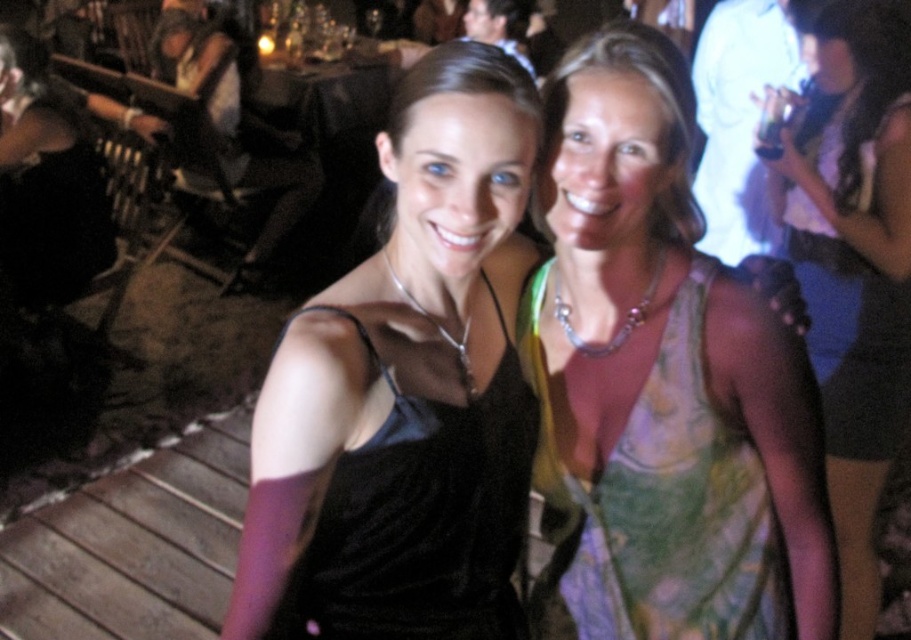
Question: Which object is farther from the camera taking this photo?

Choices:
 (A) printed silk dress at center
 (B) black satin dress at center
 (C) green floral dress at upper right
 (D) green floral dress at center

Answer: (C)

Question: Which object is closer to the camera taking this photo?

Choices:
 (A) green floral dress at upper right
 (B) black satin dress at center
 (C) printed silk dress at center
 (D) green floral dress at center

Answer: (B)

Question: Estimate the real-world distances between objects in this image. Which object is farther from the black satin dress at center?

Choices:
 (A) printed silk dress at center
 (B) green floral dress at upper right
 (C) green floral dress at center

Answer: (C)

Question: Can you confirm if printed silk dress at center is positioned below black satin dress at center?

Choices:
 (A) no
 (B) yes

Answer: (A)

Question: Does black satin dress at center appear on the left side of green floral dress at upper right?

Choices:
 (A) no
 (B) yes

Answer: (B)

Question: Can you confirm if printed silk dress at center is positioned to the right of green floral dress at upper right?

Choices:
 (A) yes
 (B) no

Answer: (B)